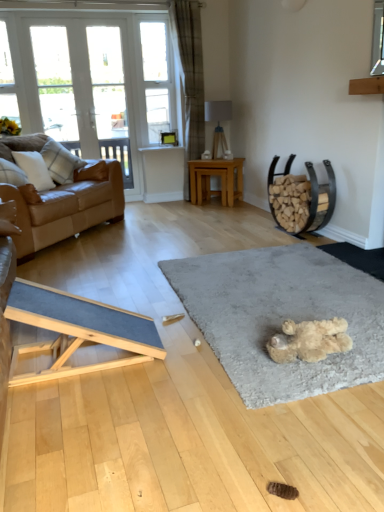
Identify the location of unoccupied region to the right of wooden ramp at lower left, arranged as the 2th table when viewed from the back. This screenshot has height=512, width=384. (190, 362).